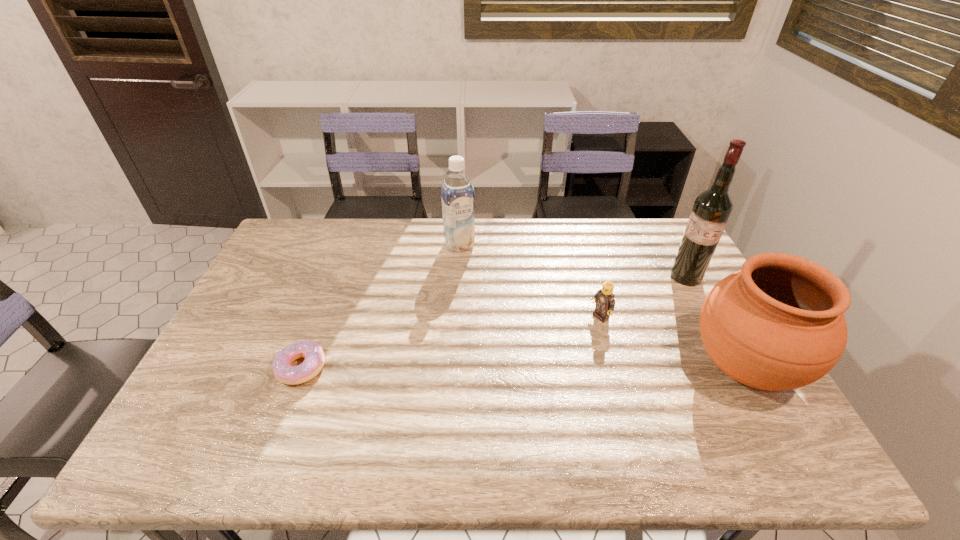
Where is `vacant space at the far right corner`? vacant space at the far right corner is located at coordinates (636, 228).

Find the location of a particular element. free space between the shortest object and the second object from left to right is located at coordinates (380, 306).

Locate an element on the screen. vacant area that lies between the third object from left to right and the soya milk is located at coordinates (530, 281).

Identify the location of free space between the soya milk and the tallest object. This screenshot has height=540, width=960. (573, 261).

Identify the location of vacant area between the farthest object and the leftmost object. (x=380, y=306).

Where is `blank region between the pottery and the third object from left to right`? blank region between the pottery and the third object from left to right is located at coordinates (672, 342).

Where is `free spot between the fourth nearest object and the shortest object`? This screenshot has height=540, width=960. free spot between the fourth nearest object and the shortest object is located at coordinates (493, 322).

Find the location of a particular element. The width and height of the screenshot is (960, 540). free space between the doughnut and the farthest object is located at coordinates (380, 306).

You are a GUI agent. You are given a task and a screenshot of the screen. Output one action in this format:
    pyautogui.click(x=<x>, y=<y>)
    Task: Click on the empty space that is in between the Lego and the pottery
    Image resolution: width=960 pixels, height=540 pixels.
    Given the screenshot: What is the action you would take?
    pyautogui.click(x=672, y=342)

Point out which object is positioned as the nearest to the third object from right to left. Please provide its 2D coordinates. Your answer should be formatted as a tuple, i.e. [(x, y)], where the tuple contains the x and y coordinates of a point satisfying the conditions above.

[(777, 324)]